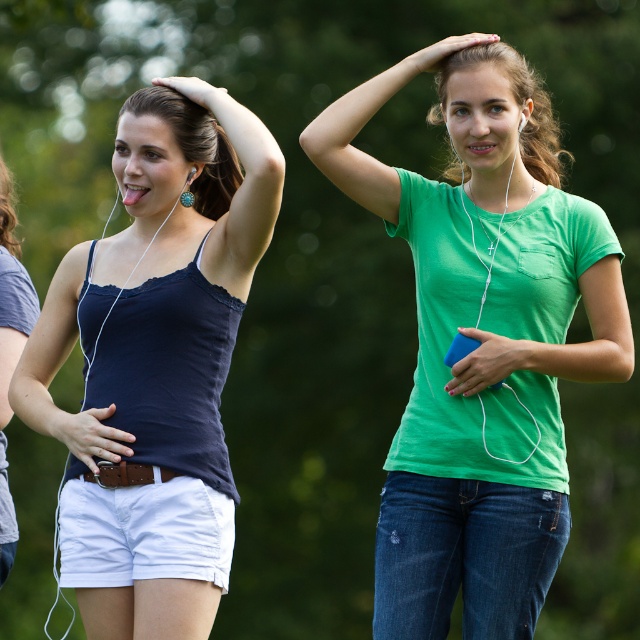
Based on the scene description, which object, the green cotton shirt at center or the white cotton shorts at lower left, is bigger in size?

The green cotton shirt at center is larger in size compared to the white cotton shorts at lower left according to the description.

You are a fashion designer analyzing an outfit. The outfit consists of a green cotton shirt at center and white cotton shorts at lower left. Which item of clothing is taller?

The green cotton shirt at center is taller than the white cotton shorts at lower left.